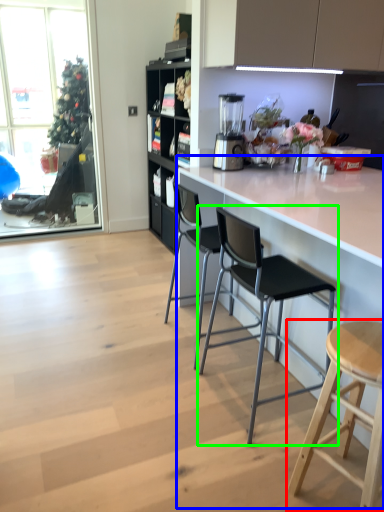
Question: Which object is the closest to the stool (highlighted by a red box)? Choose among these: counter (highlighted by a blue box) or chair (highlighted by a green box).

Choices:
 (A) counter
 (B) chair

Answer: (B)